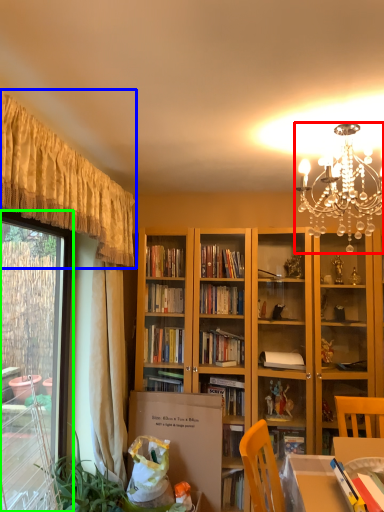
Question: Which object is positioned closest to lamp (highlighted by a red box)? Select from curtain (highlighted by a blue box) and window (highlighted by a green box).

Choices:
 (A) curtain
 (B) window

Answer: (A)